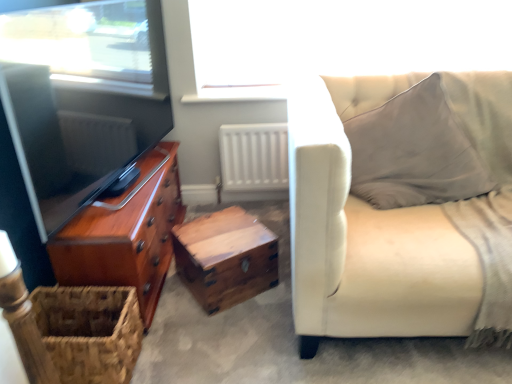
Describe the element at coordinates (126, 234) in the screenshot. The width and height of the screenshot is (512, 384). I see `shiny brown chest of drawers at left` at that location.

Locate an element on the screen. wooden trunk at center is located at coordinates (225, 258).

This screenshot has height=384, width=512. What do you see at coordinates (225, 258) in the screenshot? I see `wooden trunk at center` at bounding box center [225, 258].

What do you see at coordinates (90, 331) in the screenshot? I see `woven brown basket at lower left` at bounding box center [90, 331].

The image size is (512, 384). What do you see at coordinates (340, 40) in the screenshot? I see `transparent glass window at upper center` at bounding box center [340, 40].

The image size is (512, 384). I want to click on shiny brown chest of drawers at left, so click(x=126, y=234).

Are light beige fabric couch at right and transparent glass window at upper center beside each other?

light beige fabric couch at right and transparent glass window at upper center are not in contact.

Is the depth of light beige fabric couch at right greater than that of transparent glass window at upper center?

No, light beige fabric couch at right is closer to the viewer.

Measure the distance between light beige fabric couch at right and transparent glass window at upper center.

31.82 inches.

At what (x,y) coordinates should I click in order to perform the action: click on studio couch below the transparent glass window at upper center (from the image's perspective). Please return your answer as a coordinate pair (x, y). Image resolution: width=512 pixels, height=384 pixels. Looking at the image, I should click on (399, 220).

Is point (246, 287) farther from camera compared to point (209, 40)?

That is False.

From a real-world perspective, between wooden trunk at center and transparent glass window at upper center, who is vertically lower?

wooden trunk at center.

Is transparent glass window at upper center a part of wooden trunk at center?

No, transparent glass window at upper center is not a part of wooden trunk at center.

Does wooden trunk at center have a lesser width compared to transparent glass window at upper center?

No.

From a real-world perspective, is white matte radiator at center located beneath woven brown basket at lower left?

Incorrect, from a real-world perspective, white matte radiator at center is higher than woven brown basket at lower left.

You are a GUI agent. You are given a task and a screenshot of the screen. Output one action in this format:
    pyautogui.click(x=<x>, y=<y>)
    Task: Click on the basket directly beneath the white matte radiator at center (from a real-world perspective)
    The width and height of the screenshot is (512, 384).
    Given the screenshot: What is the action you would take?
    pyautogui.click(x=90, y=331)

Does white matte radiator at center touch woven brown basket at lower left?

They are not placed beside each other.

Considering the relative positions of white matte radiator at center and woven brown basket at lower left in the image provided, is white matte radiator at center behind woven brown basket at lower left?

Yes, it is.

Does wooden trunk at center appear on the right side of woven brown basket at lower left?

Correct, you'll find wooden trunk at center to the right of woven brown basket at lower left.

Considering the sizes of objects wooden trunk at center and woven brown basket at lower left in the image provided, who is bigger, wooden trunk at center or woven brown basket at lower left?

wooden trunk at center.

From the picture: From a real-world perspective, does wooden trunk at center sit lower than woven brown basket at lower left?

Indeed, from a real-world perspective, wooden trunk at center is positioned beneath woven brown basket at lower left.

Consider the image. Is wooden trunk at center far from woven brown basket at lower left?

They are positioned close to each other.

Does point (296, 321) appear closer or farther from the camera than point (139, 291)?

Clearly, point (296, 321) is closer to the camera than point (139, 291).

Is light beige fabric couch at right at the right side of shiny brown chest of drawers at left?

Yes.

Can you confirm if light beige fabric couch at right is wider than shiny brown chest of drawers at left?

Yes.

Considering the relative sizes of light beige fabric couch at right and shiny brown chest of drawers at left in the image provided, is light beige fabric couch at right taller than shiny brown chest of drawers at left?

Correct, light beige fabric couch at right is much taller as shiny brown chest of drawers at left.

Is wooden trunk at center facing towards white matte radiator at center?

No, wooden trunk at center does not turn towards white matte radiator at center.

Is wooden trunk at center spatially inside white matte radiator at center, or outside of it?

wooden trunk at center cannot be found inside white matte radiator at center.

Is point (181, 231) less distant than point (280, 178)?

Yes, it is in front of point (280, 178).

From the picture: Between shiny brown chest of drawers at left and woven brown basket at lower left, which one has larger size?

shiny brown chest of drawers at left is bigger.

Is shiny brown chest of drawers at left situated inside woven brown basket at lower left or outside?

shiny brown chest of drawers at left lies outside woven brown basket at lower left.

From a real-world perspective, is shiny brown chest of drawers at left above or below woven brown basket at lower left?

Clearly, from a real-world perspective, shiny brown chest of drawers at left is above woven brown basket at lower left.

From the image's perspective, is shiny brown chest of drawers at left above or below woven brown basket at lower left?

shiny brown chest of drawers at left is situated higher than woven brown basket at lower left in the image.

Where is `window screen on the left of light beige fabric couch at right`? window screen on the left of light beige fabric couch at right is located at coordinates (340, 40).

Locate an element on the screen. Image resolution: width=512 pixels, height=384 pixels. table in front of the transparent glass window at upper center is located at coordinates click(x=225, y=258).

When comparing their distances from woven brown basket at lower left, does transparent glass window at upper center or light beige fabric couch at right seem further?

transparent glass window at upper center lies further to woven brown basket at lower left than the other object.

Based on their spatial positions, is woven brown basket at lower left or shiny brown chest of drawers at left closer to transparent glass window at upper center?

Among the two, shiny brown chest of drawers at left is located nearer to transparent glass window at upper center.

Which object lies further to the anchor point white matte radiator at center, woven brown basket at lower left or transparent glass window at upper center?

woven brown basket at lower left is further to white matte radiator at center.

Based on their spatial positions, is shiny brown chest of drawers at left or light beige fabric couch at right further from transparent glass window at upper center?

Based on the image, shiny brown chest of drawers at left appears to be further to transparent glass window at upper center.

From the image, which object appears to be farther from light beige fabric couch at right, white matte radiator at center or wooden trunk at center?

Among the two, white matte radiator at center is located further to light beige fabric couch at right.

Based on their spatial positions, is wooden trunk at center or light beige fabric couch at right closer to shiny brown chest of drawers at left?

The object closer to shiny brown chest of drawers at left is wooden trunk at center.

Which object lies nearer to the anchor point shiny brown chest of drawers at left, woven brown basket at lower left or white matte radiator at center?

Based on the image, woven brown basket at lower left appears to be nearer to shiny brown chest of drawers at left.

Considering their positions, is wooden trunk at center positioned closer to shiny brown chest of drawers at left than white matte radiator at center?

wooden trunk at center is closer to shiny brown chest of drawers at left.

This screenshot has width=512, height=384. Identify the location of radiator between shiny brown chest of drawers at left and light beige fabric couch at right from left to right. (254, 157).

The image size is (512, 384). What are the coordinates of `studio couch between transparent glass window at upper center and wooden trunk at center in the vertical direction` in the screenshot? It's located at pos(399,220).

Locate an element on the screen. This screenshot has height=384, width=512. chest of drawers between transparent glass window at upper center and wooden trunk at center from top to bottom is located at coordinates (126, 234).

This screenshot has height=384, width=512. Identify the location of table between shiny brown chest of drawers at left and light beige fabric couch at right in the horizontal direction. (225, 258).